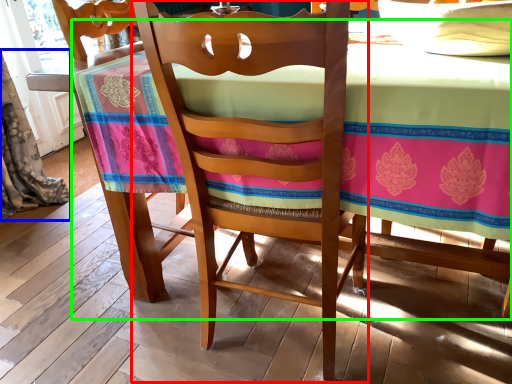
Question: Based on their relative distances, which object is farther from chair (highlighted by a red box)? Choose from curtain (highlighted by a blue box) and table (highlighted by a green box).

Choices:
 (A) curtain
 (B) table

Answer: (A)